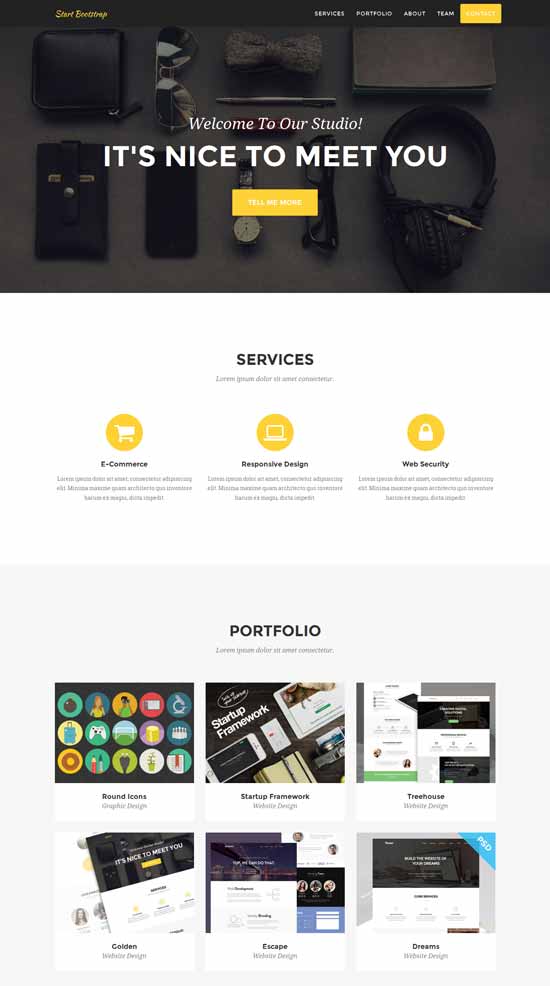
The height and width of the screenshot is (986, 550). I want to click on pen, so click(x=289, y=100).